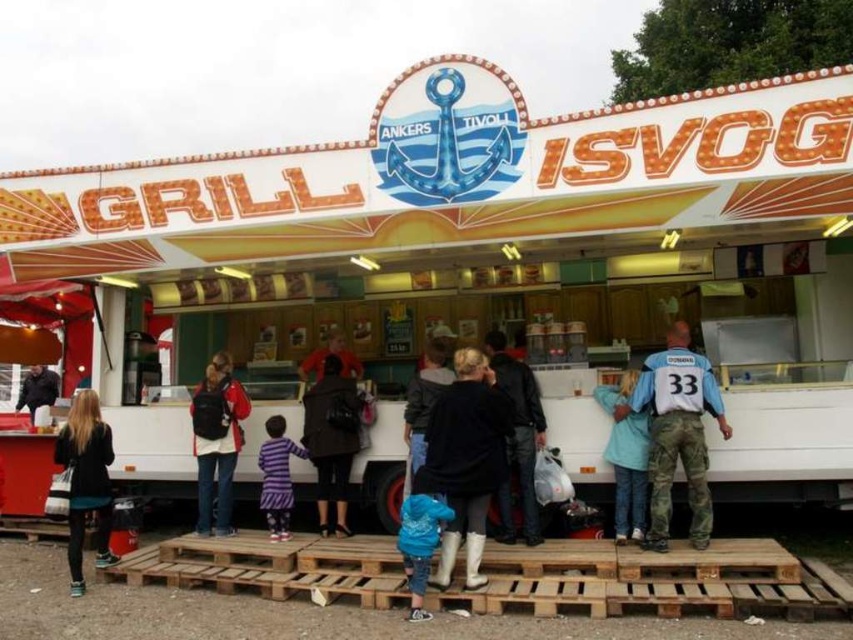
Who is positioned more to the right, black matte jacket at center or white jersey at center?

white jersey at center is more to the right.

Is point (477, 364) positioned behind point (666, 419)?

No, it is in front of (666, 419).

You are a GUI agent. You are given a task and a screenshot of the screen. Output one action in this format:
    pyautogui.click(x=<x>, y=<y>)
    Task: Click on the black matte jacket at center
    The width and height of the screenshot is (853, 640).
    Given the screenshot: What is the action you would take?
    coord(465,460)

Can you confirm if black matte jacket at center is positioned to the right of dark brown leather jacket at lower left?

Correct, you'll find black matte jacket at center to the right of dark brown leather jacket at lower left.

Can you confirm if black matte jacket at center is wider than dark brown leather jacket at lower left?

Yes.

Is point (460, 397) closer to viewer compared to point (45, 372)?

That is True.

The width and height of the screenshot is (853, 640). I want to click on black matte jacket at center, so click(465, 460).

Is matte black backpack at center shorter than blue rubber boots at lower center?

No, matte black backpack at center is not shorter than blue rubber boots at lower center.

Between matte black backpack at center and blue rubber boots at lower center, which one is positioned higher?

Positioned higher is matte black backpack at center.

Is point (207, 458) behind point (424, 548)?

Yes, point (207, 458) is behind point (424, 548).

I want to click on matte black backpack at center, so click(216, 442).